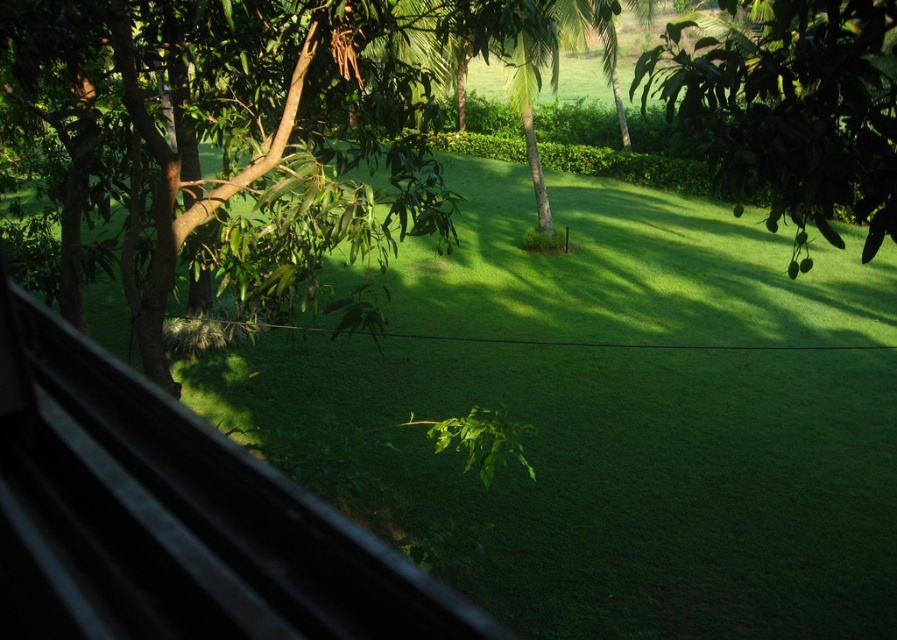
Which is below, green leafy tree at upper left or green leafy tree at upper right?

green leafy tree at upper left

What do you see at coordinates (251, 125) in the screenshot?
I see `green leafy tree at upper left` at bounding box center [251, 125].

Locate an element on the screen. Image resolution: width=897 pixels, height=640 pixels. green leafy tree at upper left is located at coordinates (251, 125).